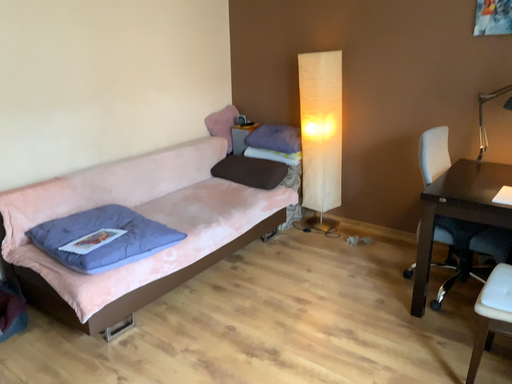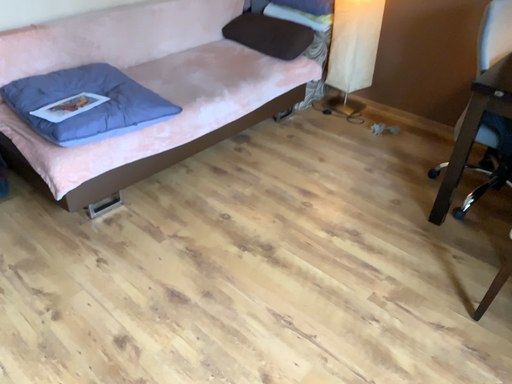
Question: Which way did the camera rotate in the video?

Choices:
 (A) rotated upward
 (B) rotated downward

Answer: (B)